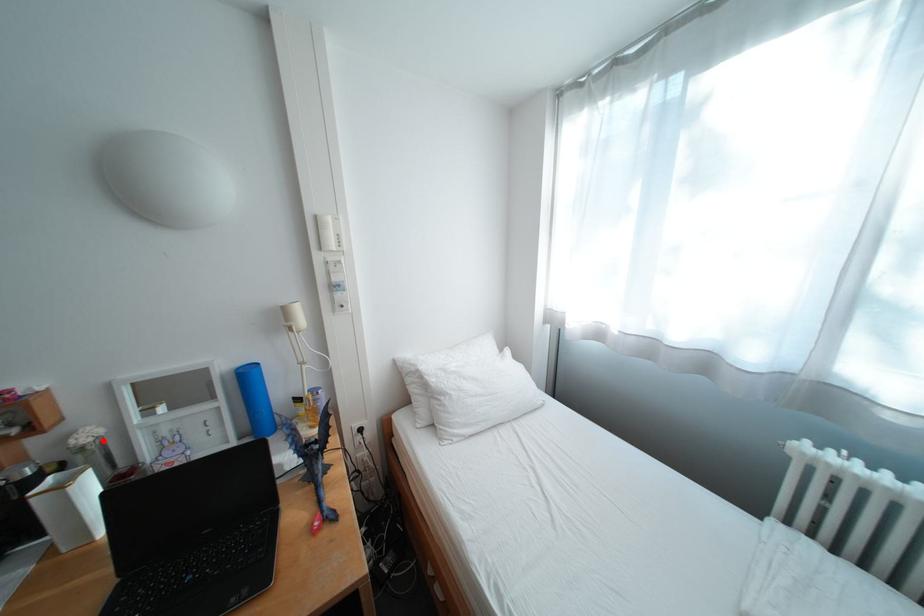
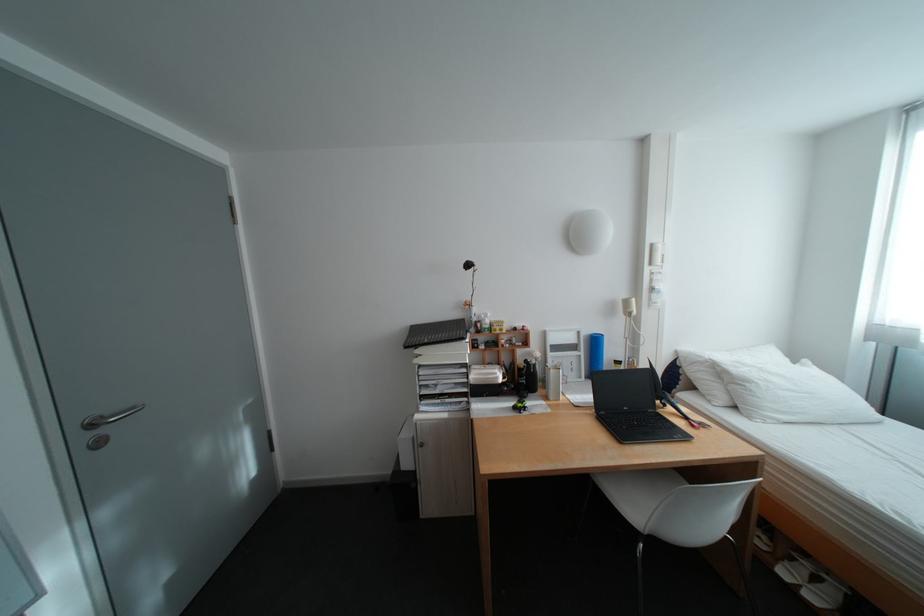
The point at the highlighted location is marked in the first image. Where is the corresponding point in the second image?

(552, 358)